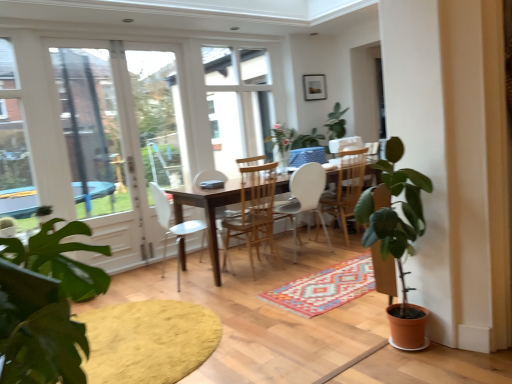
The height and width of the screenshot is (384, 512). In order to click on unoccupied region to the right of wooden chair at center, the 3th chair when ordered from right to left in this screenshot , I will do `click(304, 264)`.